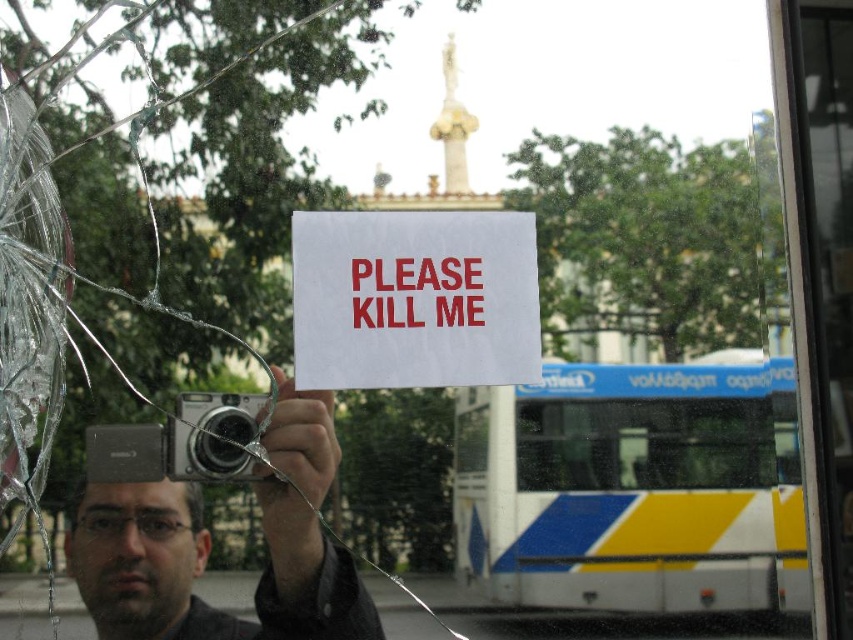
You are a photographer trying to capture the bus in the background. You have a matte silver camera at center. Can you fit the entire white plastic bus at lower right in your camera frame?

The white plastic bus at lower right is shorter than the matte silver camera at center. Since the bus is shorter, it can fit within the camera frame.

You are a photographer standing 1.5 meters away from a cracked glass window. You see the white paper sign at center through the window. Can you reach the sign without moving closer than your current position?

A: The white paper sign at center is 1.29 meters away from viewer, so you cannot reach it without moving closer than your current position of 1.5 meters.